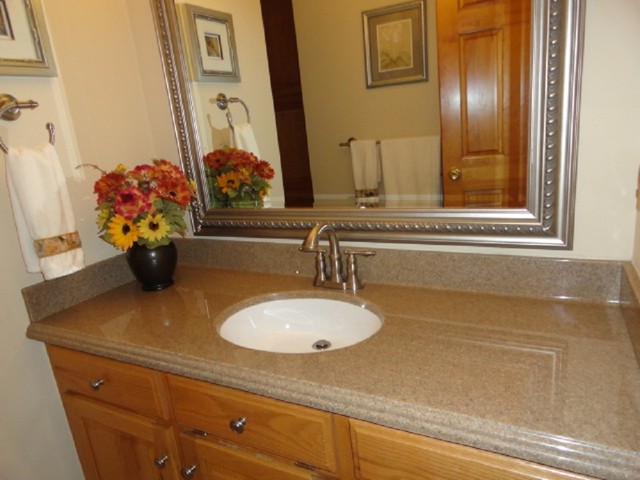
Locate an element on the screen. The image size is (640, 480). bathroom counter is located at coordinates (491, 312).